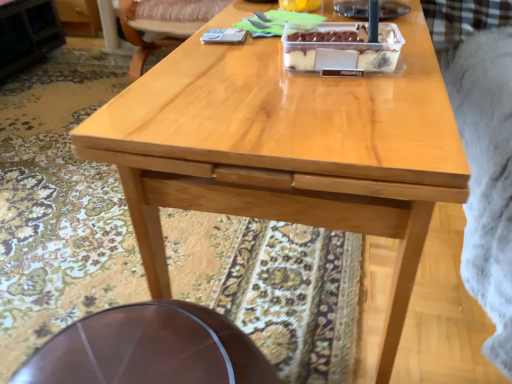
Locate an element on the screen. blank space to the left of translucent plastic container at center is located at coordinates (241, 71).